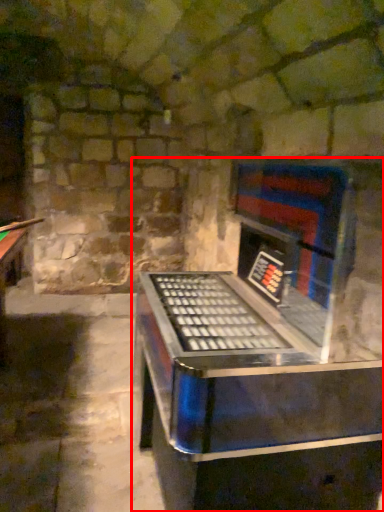
Question: From the image, what is the correct spatial relationship of furniture (annotated by the red box) in relation to cue?

Choices:
 (A) right
 (B) left

Answer: (A)